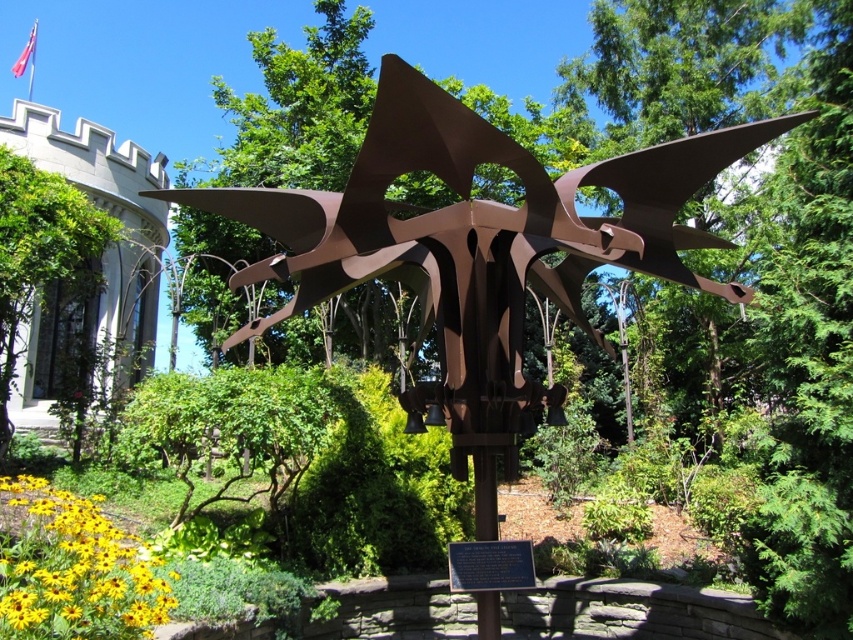
Question: Is rusty metal sculpture at center to the right of green leafy tree at left from the viewer's perspective?

Choices:
 (A) no
 (B) yes

Answer: (B)

Question: Which of the following is the farthest from the observer?

Choices:
 (A) (769, 120)
 (B) (99, 236)

Answer: (B)

Question: Is rusty metal sculpture at center positioned at the back of green leafy tree at left?

Choices:
 (A) yes
 (B) no

Answer: (B)

Question: Is rusty metal sculpture at center further to the viewer compared to green leafy tree at left?

Choices:
 (A) no
 (B) yes

Answer: (A)